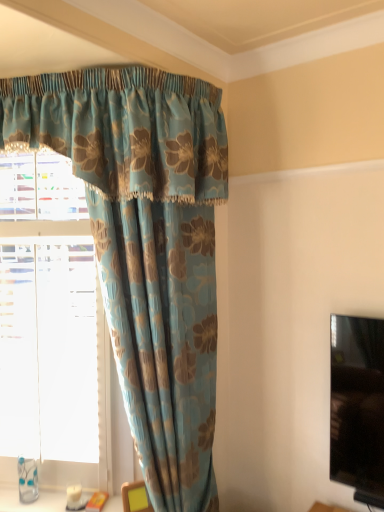
Question: Considering the positions of blue floral curtain at upper left and blue floral fabric curtain at upper left in the image, is blue floral curtain at upper left bigger or smaller than blue floral fabric curtain at upper left?

Choices:
 (A) small
 (B) big

Answer: (A)

Question: From a real-world perspective, is blue floral curtain at upper left physically located above or below blue floral fabric curtain at upper left?

Choices:
 (A) above
 (B) below

Answer: (A)

Question: Estimate the real-world distances between objects in this image. Which object is farther from the yellow fabric at lower center?

Choices:
 (A) blue floral fabric curtain at upper left
 (B) blue floral curtain at upper left

Answer: (A)

Question: Estimate the real-world distances between objects in this image. Which object is farther from the blue floral curtain at upper left?

Choices:
 (A) yellow fabric at lower center
 (B) blue floral fabric curtain at upper left

Answer: (A)